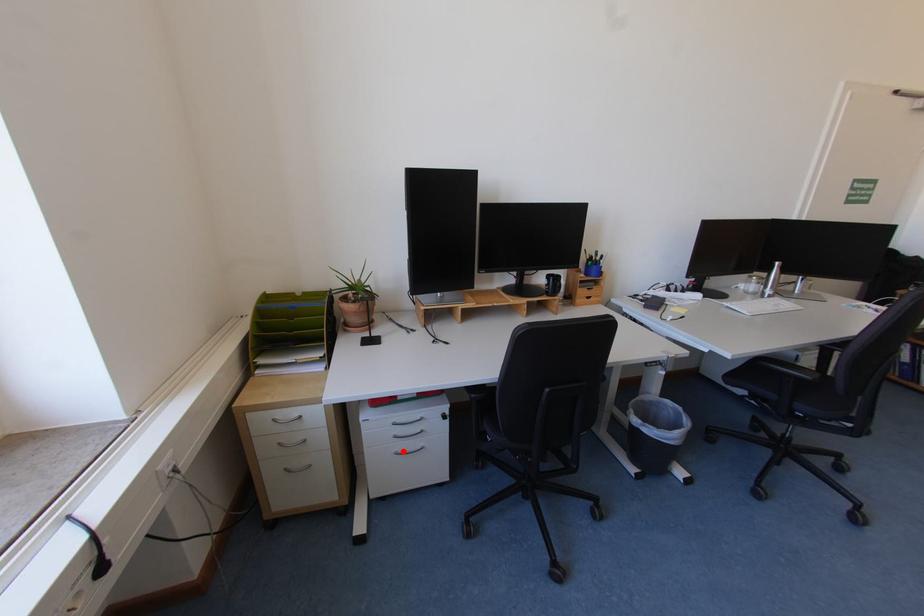
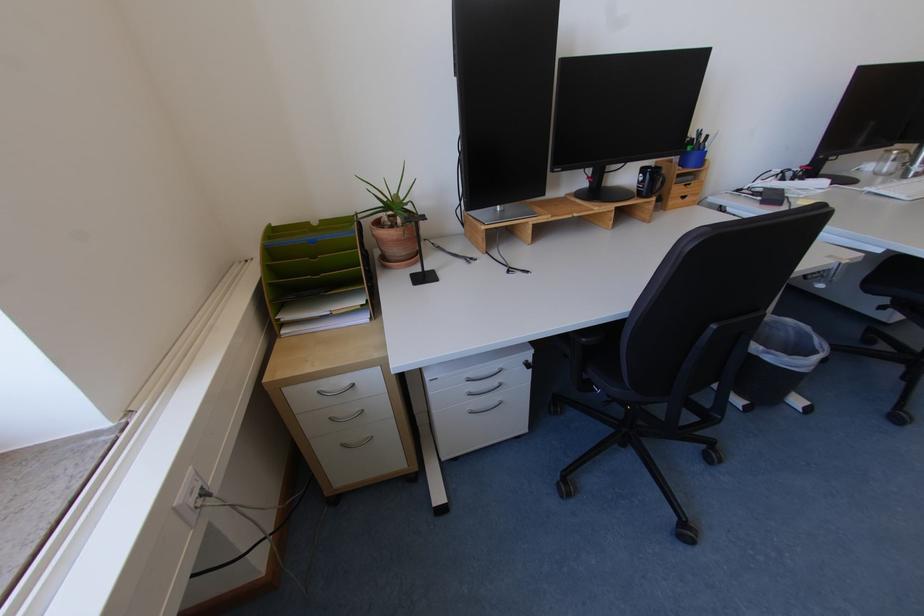
Locate, in the second image, the point that corresponds to the highlighted location in the first image.

(477, 410)